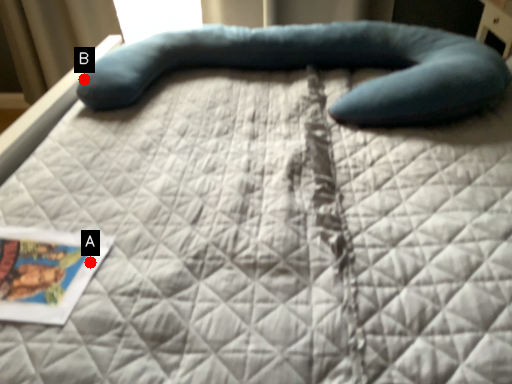
Question: Two points are circled on the image, labeled by A and B beside each circle. Which point is further to the camera?

Choices:
 (A) A is further
 (B) B is further

Answer: (B)